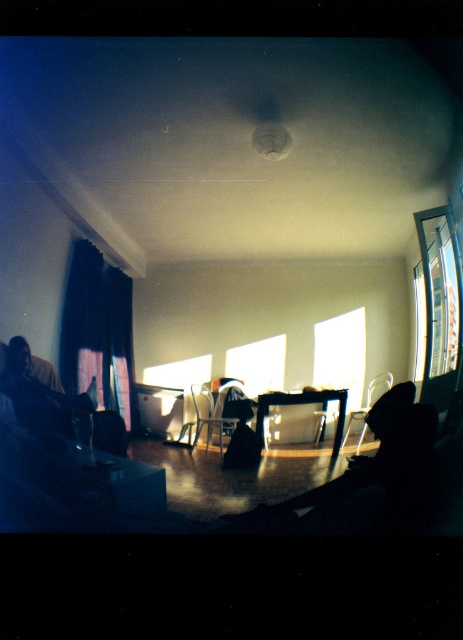
You are standing in the living room and want to move from the silhouette figure at lower right to the transparent glass window at center. Which direction should you move to get closer to the window?

The silhouette figure at lower right is to the right of the transparent glass window at center, so you should move to the left to get closer to the window.

You are standing in the room and want to pick up an object located at point (331, 369) and another object at point (342, 394). Which object will be easier to reach without moving your position?

The object at point (331, 369) will be easier to reach because it is closer to you than the object at point (342, 394).

You are a delivery person who needs to place a package on the matte black table at center. The silhouette figure at lower right is blocking your path. Can you walk around them to reach the table?

The matte black table at center is behind the silhouette figure at lower right, so you can walk around the silhouette figure at lower right to access the table.